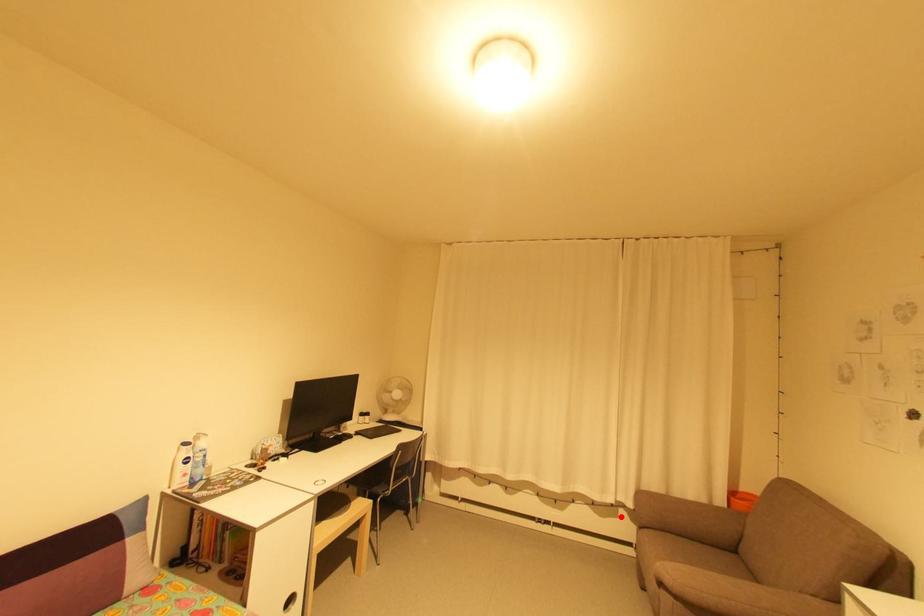
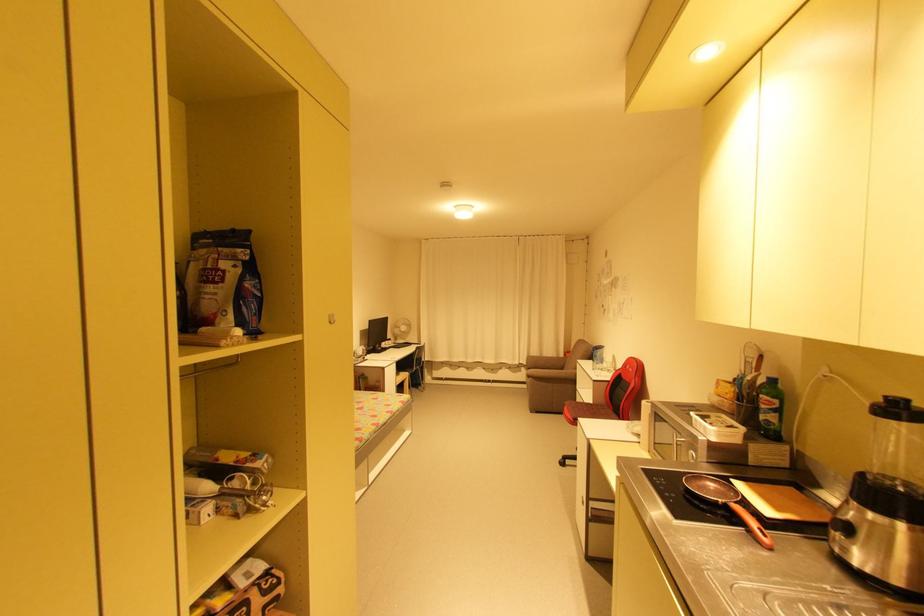
Question: I am providing you with two images of the same scene from different viewpoints. A red point is shown in image1. For the corresponding object point in image2, is it positioned nearer or farther from the camera?

Choices:
 (A) Nearer
 (B) Farther

Answer: (B)